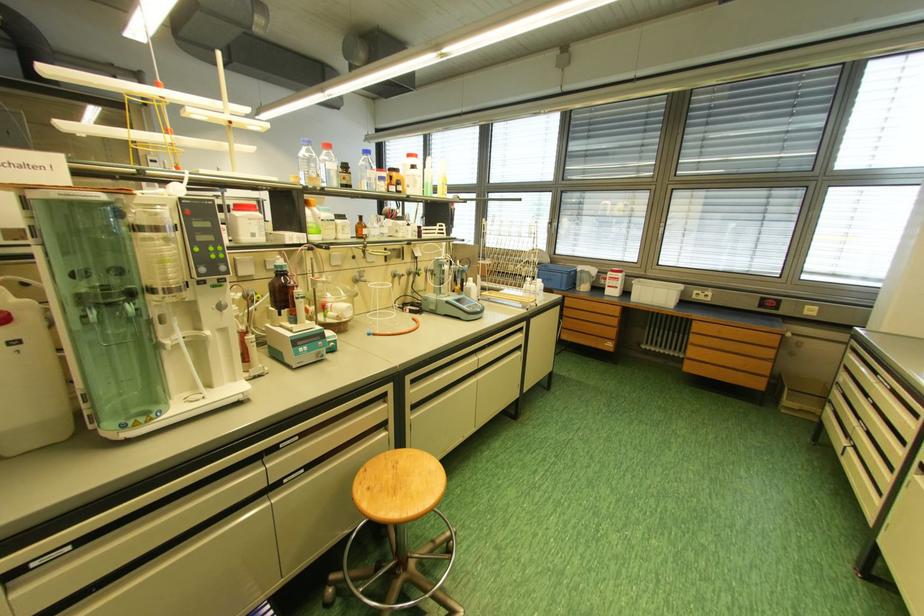
The height and width of the screenshot is (616, 924). Find the location of `amber glass bottle`. amber glass bottle is located at coordinates (282, 290).